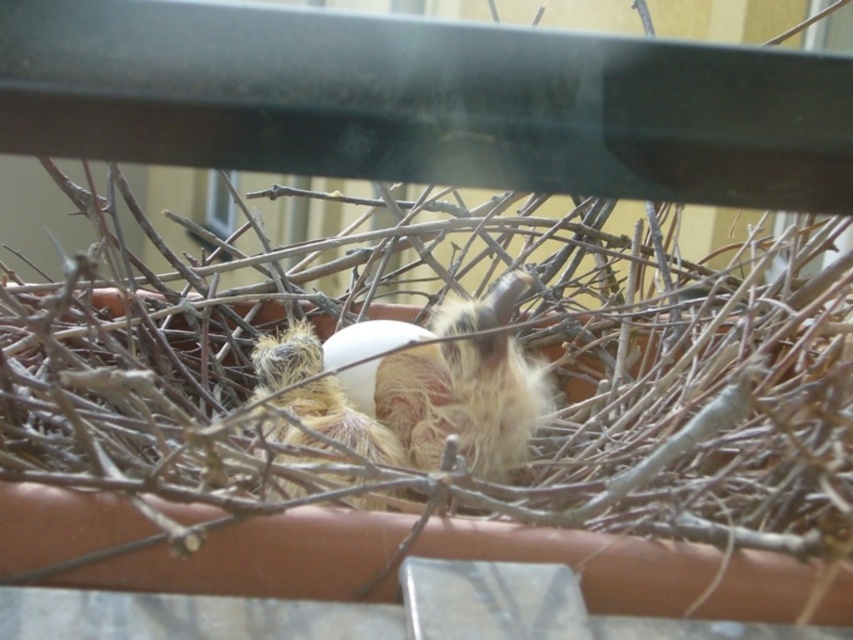
Question: Among these points, which one is nearest to the camera?

Choices:
 (A) (300, 488)
 (B) (514, 460)

Answer: (A)

Question: Does fluffy downy bird at center appear over fuzzy downy bird at center?

Choices:
 (A) no
 (B) yes

Answer: (B)

Question: Among these points, which one is farthest from the camera?

Choices:
 (A) (508, 460)
 (B) (309, 353)

Answer: (B)

Question: Is the position of fluffy downy bird at center more distant than that of fuzzy downy bird at center?

Choices:
 (A) yes
 (B) no

Answer: (A)

Question: Does fluffy downy bird at center come in front of fuzzy downy bird at center?

Choices:
 (A) no
 (B) yes

Answer: (A)